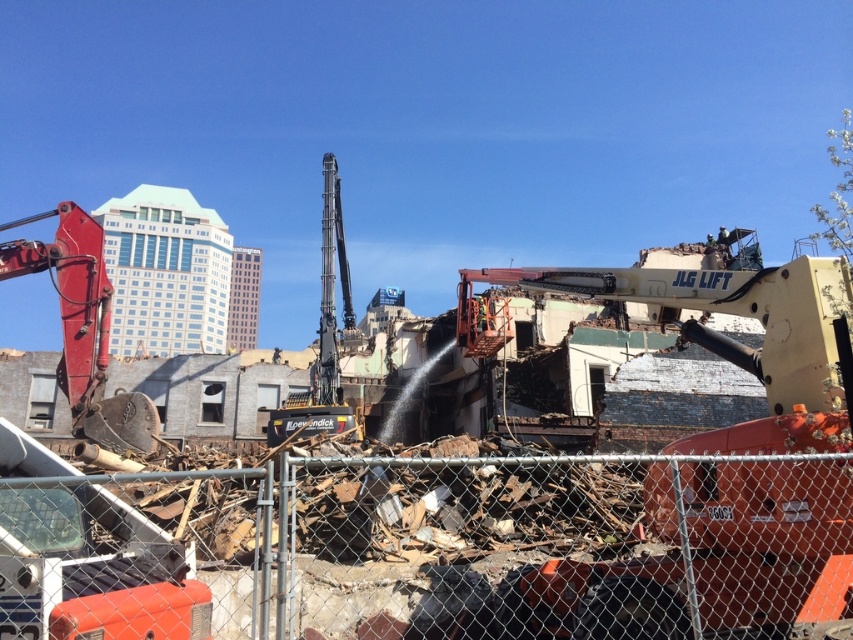
You are a construction worker standing at the chain link fence. You need to move to the yellow metallic excavator at center to operate it. What direction should you walk from your current position at the fence to reach the excavator?

The yellow metallic excavator at center is located at point (x=706, y=556). Since you are at the chain link fence in the foreground, you should walk towards the center of the demolition site to reach the excavator.

Looking at this image, you are an inspector at the demolition site. You need to determine which excavator is taller between the yellow metallic excavator at center and the matte red excavator at left. Based on the scene, which one is taller?

The matte red excavator at left is taller than the yellow metallic excavator at center.

You are a safety inspector at the demolition site. You need to ensure that the yellow metallic excavator at center and the matte red excavator at left are positioned safely. According to the site layout, which excavator is closer to the chain link fence separating the viewer from the site?

The matte red excavator at left is closer to the chain link fence because it is positioned to the left of the yellow metallic excavator at center, which is further to the right.